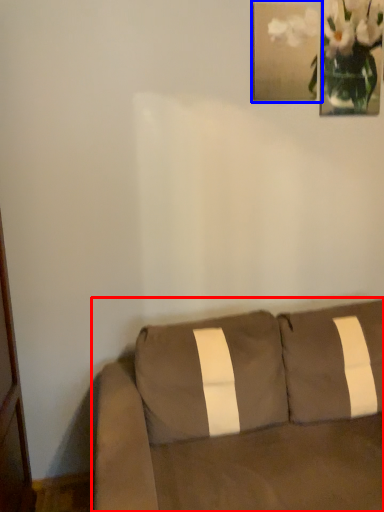
Question: Which point is closer to the camera, studio couch (highlighted by a red box) or picture frame (highlighted by a blue box)?

Choices:
 (A) studio couch
 (B) picture frame

Answer: (A)